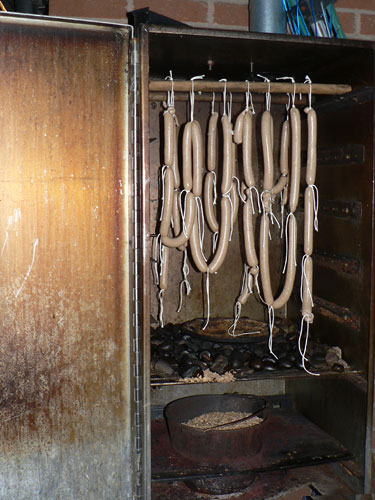
This screenshot has width=375, height=500. In order to click on pot in this screenshot , I will do `click(234, 448)`.